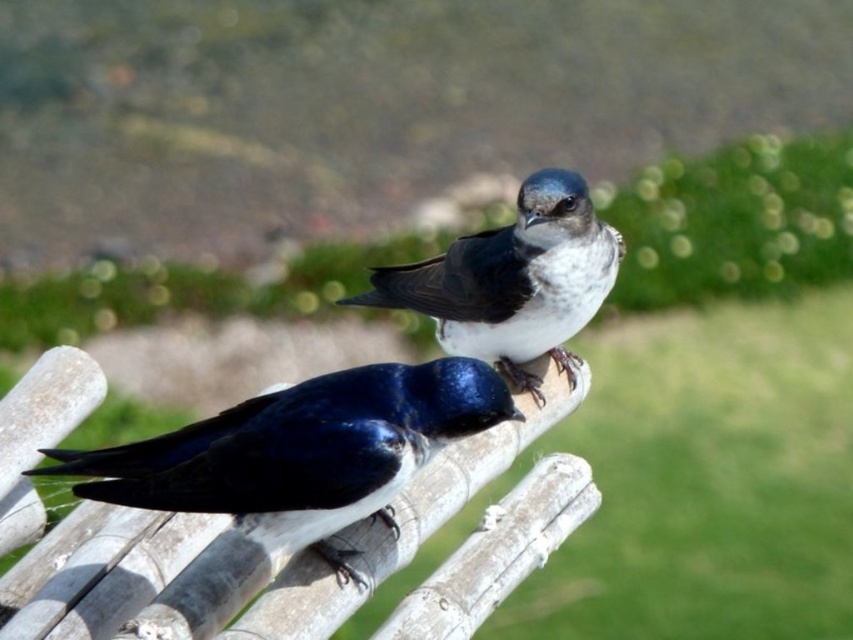
You are standing in a park and see a shiny blue bird at center perched on a wooden fence. If you want to take a photo of the bird without moving closer than 1.5 meters, will you be able to capture it in the frame from your current position?

The shiny blue bird at center is 1.52 meters away from you. Since your minimum safe distance is 1.5 meters, you can take the photo without moving closer because the distance is already beyond the required limit.

You are a birdwatcher observing the scene. You notice two birds at the center of the image. Which one is closer to you, the shiny blue bird at center or the white glossy bird at center?

The shiny blue bird at center is closer to you because it is in front of the white glossy bird at center.